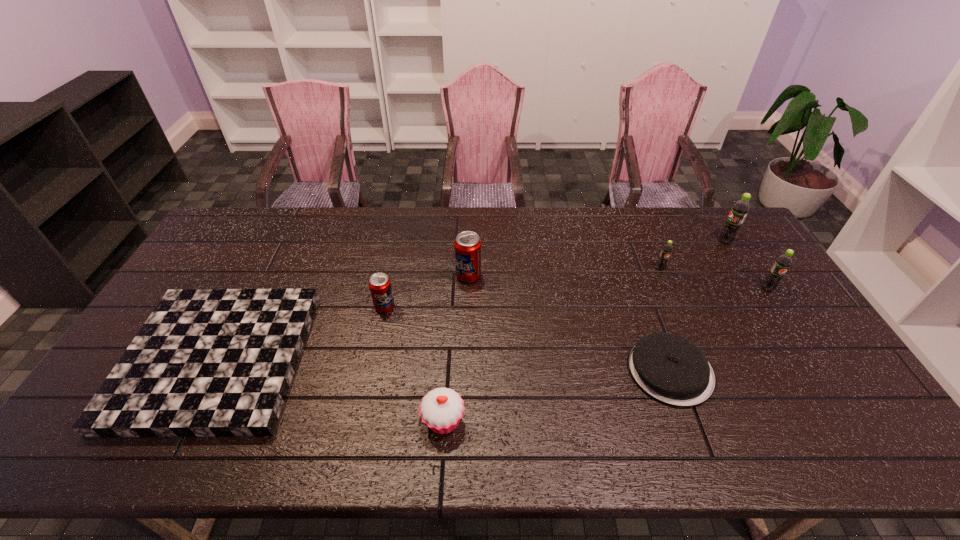
The image size is (960, 540). Identify the location of vacant space at the near edge of the desktop. (285, 434).

The width and height of the screenshot is (960, 540). In the image, there is a desktop. What are the coordinates of `vacant region at the right edge` in the screenshot? It's located at (823, 352).

This screenshot has height=540, width=960. I want to click on vacant point at the far left corner, so click(257, 232).

In the image, there is a desktop. At what (x,y) coordinates should I click in order to perform the action: click on vacant space at the near right corner. Please return your answer as a coordinate pair (x, y). The width and height of the screenshot is (960, 540). Looking at the image, I should click on (820, 429).

Where is `free space between the farthest object and the checkerboard`? free space between the farthest object and the checkerboard is located at coordinates (x=471, y=300).

The height and width of the screenshot is (540, 960). What are the coordinates of `blank region between the third soda from left to right and the seventh tallest object` in the screenshot? It's located at (665, 320).

At what (x,y) coordinates should I click in order to perform the action: click on vacant point located between the checkerboard and the nearest green soda. Please return your answer as a coordinate pair (x, y). The height and width of the screenshot is (540, 960). Looking at the image, I should click on (492, 323).

Locate an element on the screen. The height and width of the screenshot is (540, 960). free spot between the third soda from right to left and the cupcake is located at coordinates (552, 345).

Locate an element on the screen. The image size is (960, 540). unoccupied position between the cupcake and the pancake is located at coordinates (557, 395).

I want to click on empty location between the second object from left to right and the pink cupcake, so click(x=414, y=363).